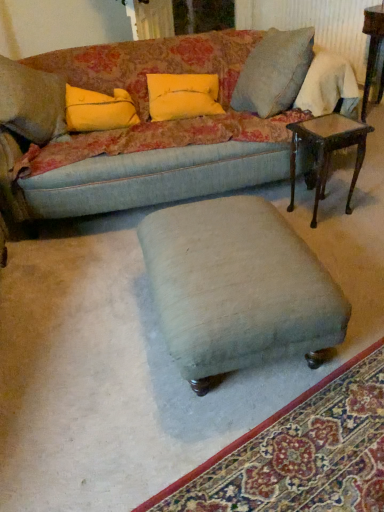
Where is `vacant point above velvet green ottoman at center (from a real-world perspective)`? The image size is (384, 512). vacant point above velvet green ottoman at center (from a real-world perspective) is located at coordinates (228, 242).